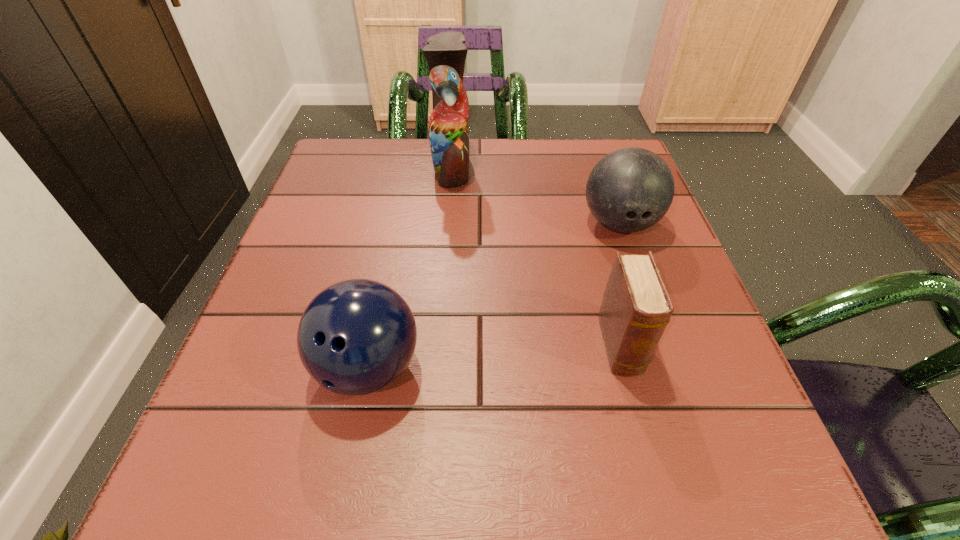
Where is `the farthest object`? Image resolution: width=960 pixels, height=540 pixels. the farthest object is located at coordinates (446, 52).

In order to click on parrot in this screenshot , I will do `click(446, 52)`.

Identify the location of the farther bowling ball. (630, 189).

Find the location of a particular element. The width and height of the screenshot is (960, 540). the right bowling ball is located at coordinates (630, 189).

This screenshot has width=960, height=540. I want to click on the left bowling ball, so click(x=356, y=337).

Identify the location of diary. (636, 307).

Identify the location of vacant area situated at the face of the tallest object. (524, 166).

In order to click on free spot located 0.300m on the grip area of the third nearest object in this screenshot , I will do `click(676, 387)`.

Find the location of a particular element. This screenshot has width=960, height=540. vacant space located on the spine side of the diary is located at coordinates (645, 437).

Where is `object situated at the far edge`? Image resolution: width=960 pixels, height=540 pixels. object situated at the far edge is located at coordinates (446, 52).